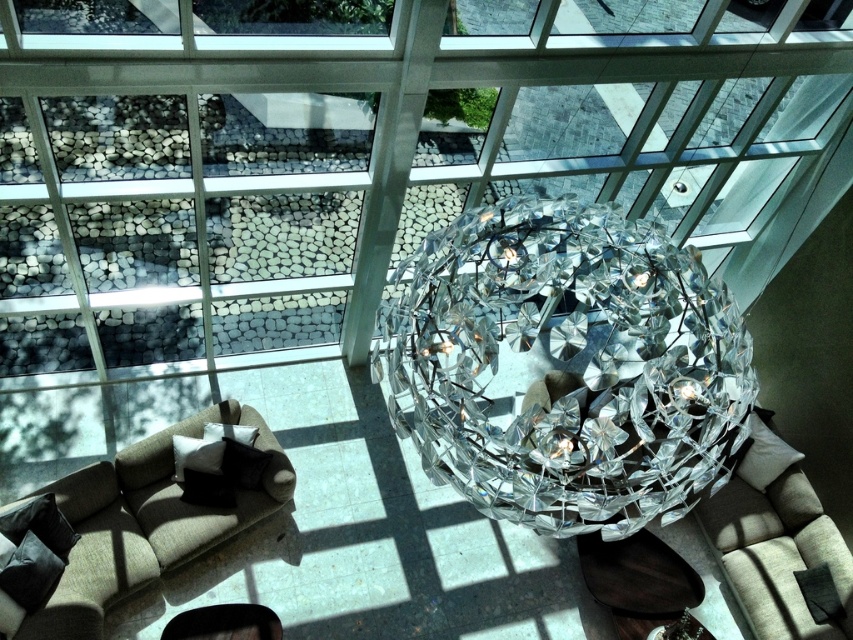
Question: Is clear crystal disco ball at center smaller than beige fabric couch at lower right?

Choices:
 (A) yes
 (B) no

Answer: (B)

Question: Does beige fabric couch at lower left appear on the left side of beige fabric couch at lower right?

Choices:
 (A) no
 (B) yes

Answer: (B)

Question: Which is farther from the beige fabric couch at lower right?

Choices:
 (A) beige fabric couch at lower left
 (B) clear crystal disco ball at center

Answer: (A)

Question: Which object appears closest to the camera in this image?

Choices:
 (A) clear crystal disco ball at center
 (B) beige fabric couch at lower left

Answer: (A)

Question: Is clear crystal disco ball at center above beige fabric couch at lower right?

Choices:
 (A) yes
 (B) no

Answer: (A)

Question: Which point appears closest to the camera in this image?

Choices:
 (A) (741, 518)
 (B) (735, 387)
 (C) (132, 484)

Answer: (B)